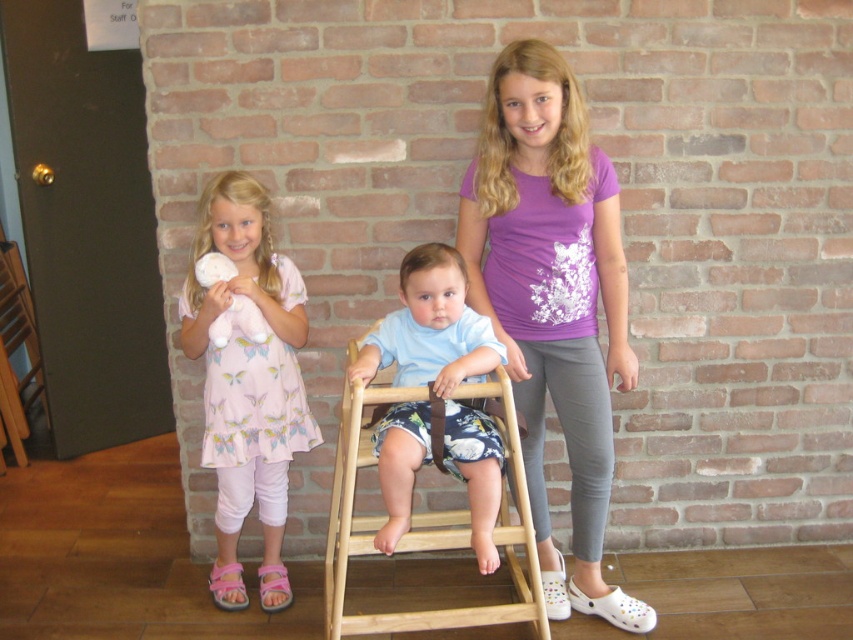
Between wooden highchair at center and white plush toy at left, which one has less height?

white plush toy at left is shorter.

Can you confirm if wooden highchair at center is positioned above white plush toy at left?

No.

Describe the element at coordinates (386, 516) in the screenshot. The width and height of the screenshot is (853, 640). I see `wooden highchair at center` at that location.

Image resolution: width=853 pixels, height=640 pixels. I want to click on wooden highchair at center, so click(386, 516).

Who is positioned more to the left, blue cotton shirt at center or wooden highchair at center?

wooden highchair at center is more to the left.

Can you confirm if blue cotton shirt at center is positioned to the left of wooden highchair at center?

In fact, blue cotton shirt at center is to the right of wooden highchair at center.

This screenshot has width=853, height=640. In order to click on blue cotton shirt at center in this screenshot , I will do `click(430, 326)`.

You are a GUI agent. You are given a task and a screenshot of the screen. Output one action in this format:
    pyautogui.click(x=<x>, y=<y>)
    Task: Click on the blue cotton shirt at center
    The width and height of the screenshot is (853, 640).
    Given the screenshot: What is the action you would take?
    pyautogui.click(x=430, y=326)

Which is behind, point (585, 417) or point (334, 548)?

Positioned behind is point (334, 548).

Is purple cotton shirt at center below wooden highchair at center?

Actually, purple cotton shirt at center is above wooden highchair at center.

Where is `purple cotton shirt at center`? The height and width of the screenshot is (640, 853). purple cotton shirt at center is located at coordinates pyautogui.click(x=553, y=301).